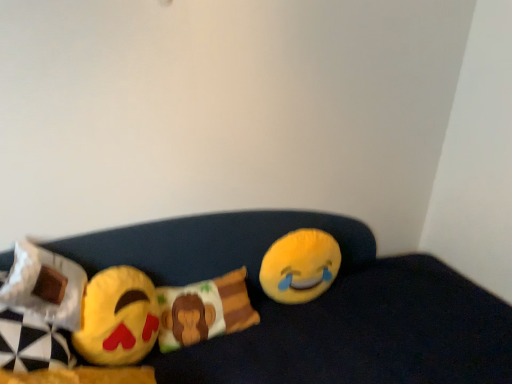
The image size is (512, 384). Identify the location of free location above matte yellow emoji at left, which appears as the 1th toy when viewed from the front (from a real-world perspective). (106, 287).